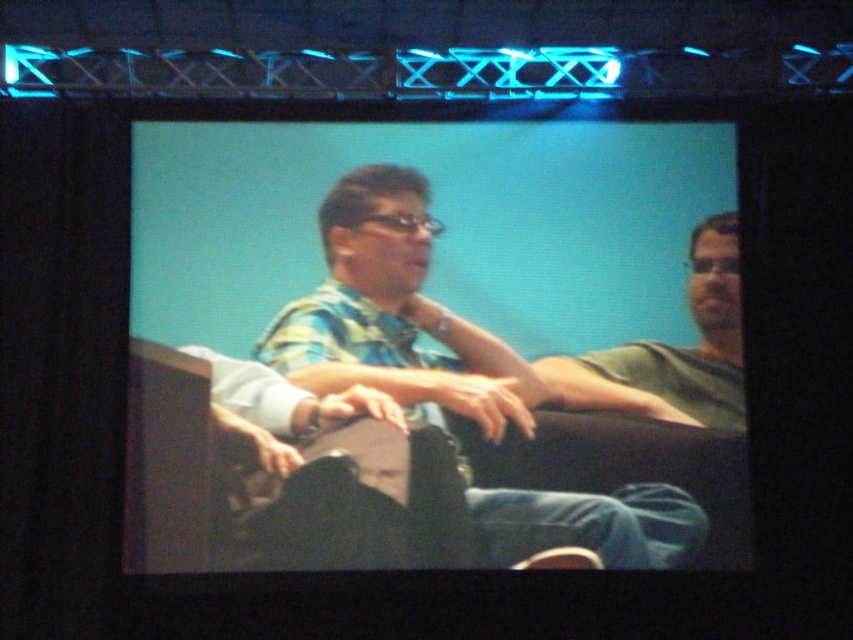
You are attending a presentation and want to determine which of the two points, point (544,540) or point (714,339), is closer to you. Based on the scene described, which point is nearer?

Point (544,540) is closer to the viewer than point (714,339).

You are a stagehand standing at the back of the room. You need to adjust the lighting above the multicolored fabric shirt at center. Considering the distance between you and the shirt, is it feasible to reach the lighting fixtures without additional equipment?

The distance between the multicolored fabric shirt at center and the viewer is 15.22 meters. Since the stagehand is at the back, they would need equipment like a ladder or lift to reach the lighting fixtures above the shirt, as 15 meters is too far to reach manually.